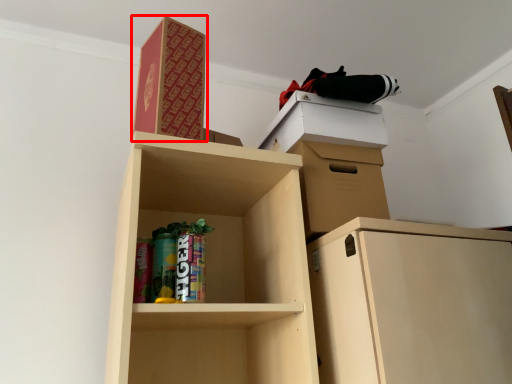
Question: Observing the image, what is the correct spatial positioning of paperback book (annotated by the red box) in reference to cabinetry?

Choices:
 (A) left
 (B) right

Answer: (A)